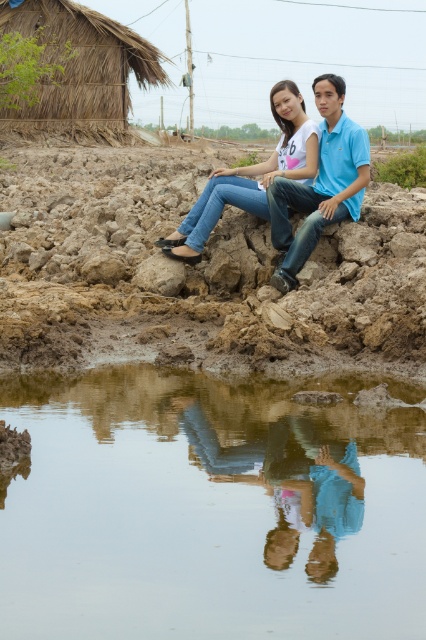
Question: From the image, what is the correct spatial relationship of thatched straw hut at upper left in relation to jeans at center?

Choices:
 (A) above
 (B) below

Answer: (A)

Question: Which of the following is the closest to the observer?

Choices:
 (A) thatched straw hut at upper left
 (B) blue cotton shirt at center

Answer: (B)

Question: Which is farther from the blue cotton shirt at center?

Choices:
 (A) jeans at center
 (B) transparent glass puddle at lower center

Answer: (B)

Question: Which of the following is the closest to the observer?

Choices:
 (A) thatched straw hut at upper left
 (B) transparent glass puddle at lower center
 (C) blue cotton shirt at center

Answer: (B)

Question: Can you confirm if transparent glass puddle at lower center is bigger than jeans at center?

Choices:
 (A) yes
 (B) no

Answer: (B)

Question: Does transparent glass puddle at lower center appear on the right side of thatched straw hut at upper left?

Choices:
 (A) yes
 (B) no

Answer: (A)